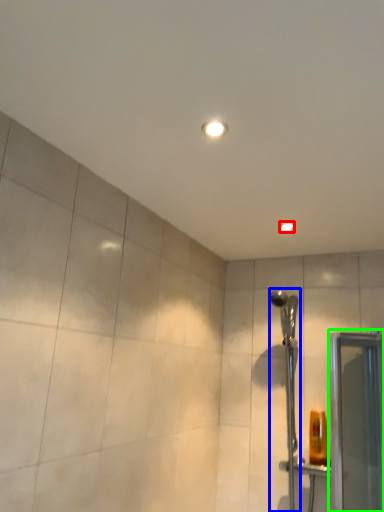
Question: Which object is the closest to the light fixture (highlighted by a red box)? Choose among these: shower (highlighted by a blue box) or screen door (highlighted by a green box).

Choices:
 (A) shower
 (B) screen door

Answer: (A)